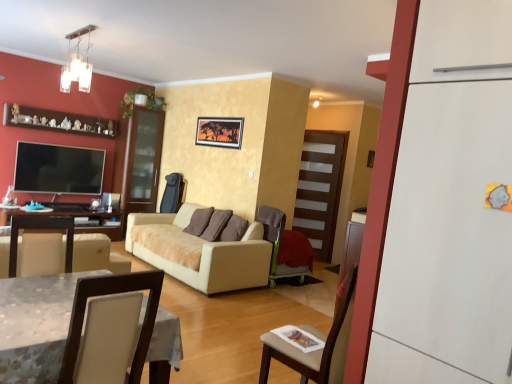
Question: From the image's perspective, is transparent glass door at center above or below white leather chair at lower left, which ranks as the 1th chair in front-to-back order?

Choices:
 (A) below
 (B) above

Answer: (B)

Question: Looking at the image, does transparent glass door at center seem bigger or smaller compared to white leather chair at lower left, arranged as the 1th chair when viewed from the left?

Choices:
 (A) small
 (B) big

Answer: (A)

Question: Based on their relative distances, which object is farther from the white matte refrigerator at right?

Choices:
 (A) flat screen tv at left
 (B) white leather chair at lower left, arranged as the second chair when viewed from the back
 (C) brown wooden shelf at upper left
 (D) brown wooden table at left
 (E) clear glass chandelier at upper left

Answer: (C)

Question: Which is farther from the white leather chair at lower left, which ranks as the 1th chair in front-to-back order?

Choices:
 (A) velvet brown armchair at center, marked as the 2th chair in a front-to-back arrangement
 (B) white matte refrigerator at right
 (C) brown wooden shelf at upper left
 (D) transparent glass door at center
 (E) flat screen tv at left

Answer: (C)